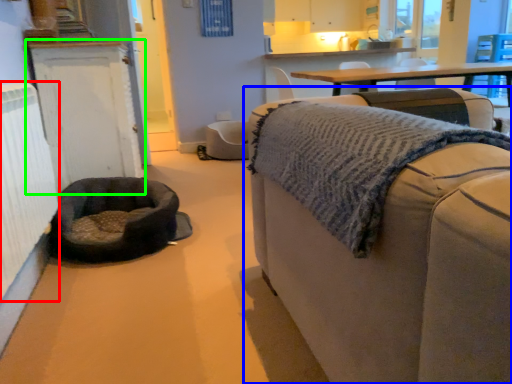
Question: Which is farther away from radiator (highlighted by a red box)? studio couch (highlighted by a blue box) or cabinetry (highlighted by a green box)?

Choices:
 (A) studio couch
 (B) cabinetry

Answer: (A)